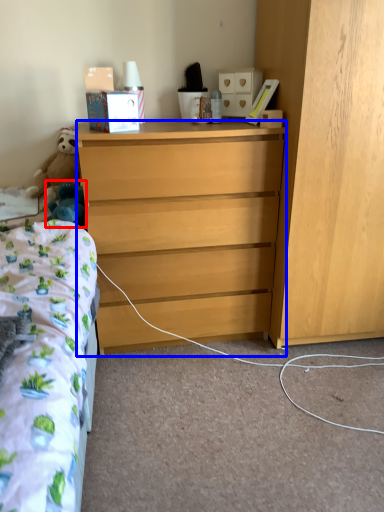
Question: Among these objects, which one is farthest to the camera, toy (highlighted by a red box) or desk (highlighted by a blue box)?

Choices:
 (A) toy
 (B) desk

Answer: (A)